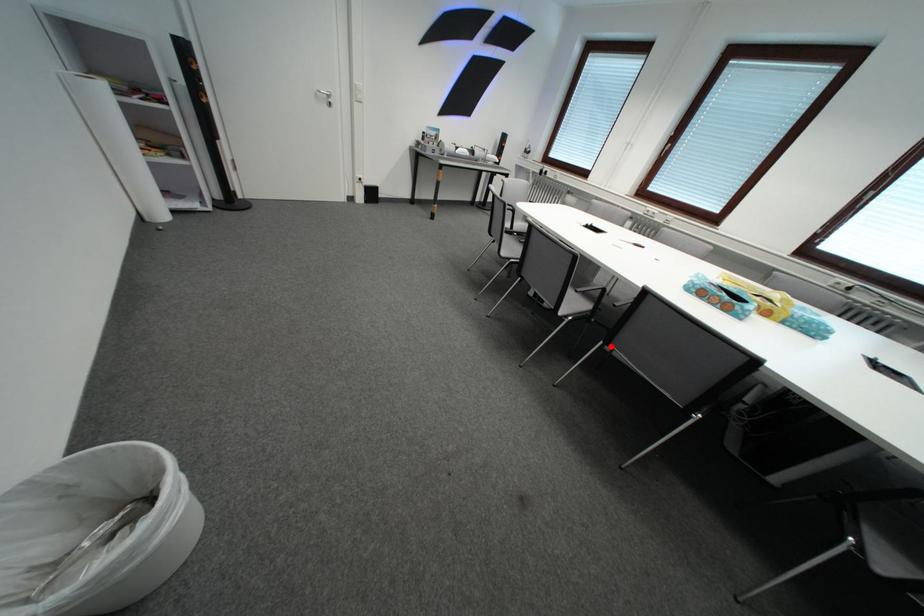
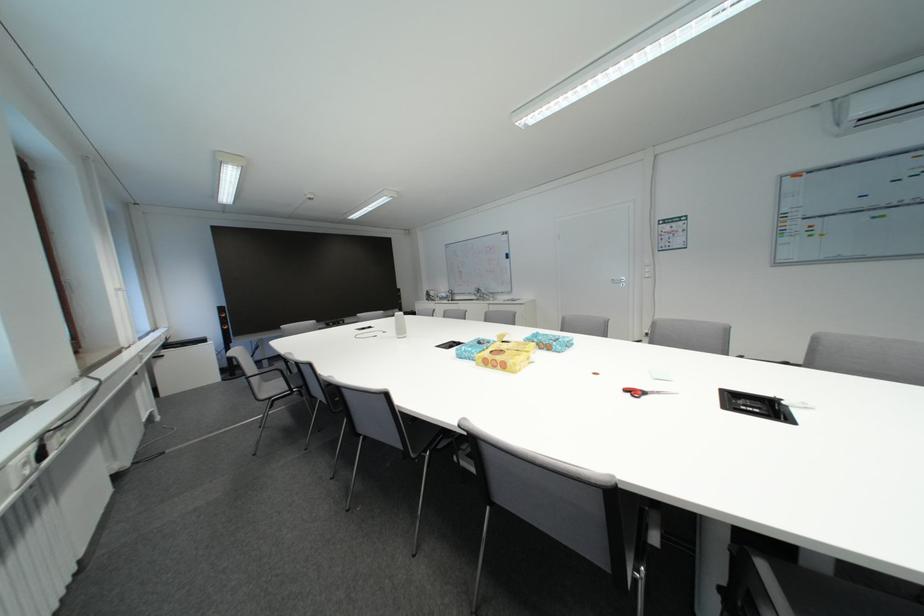
Question: I am providing you with two images of the same scene from different viewpoints. A red point is marked on the first image. Can you still see the location of the red point in image 2?

Choices:
 (A) Yes
 (B) No

Answer: (B)